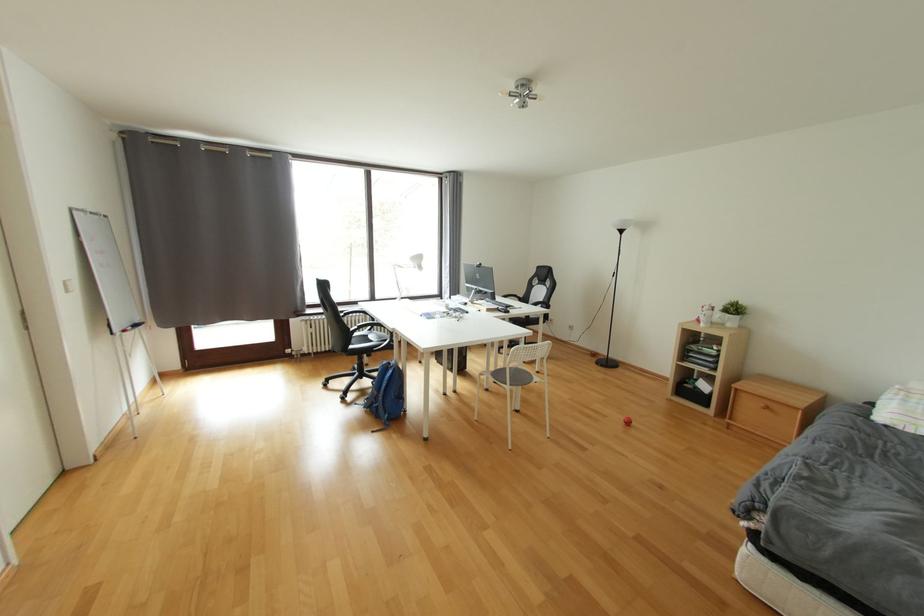
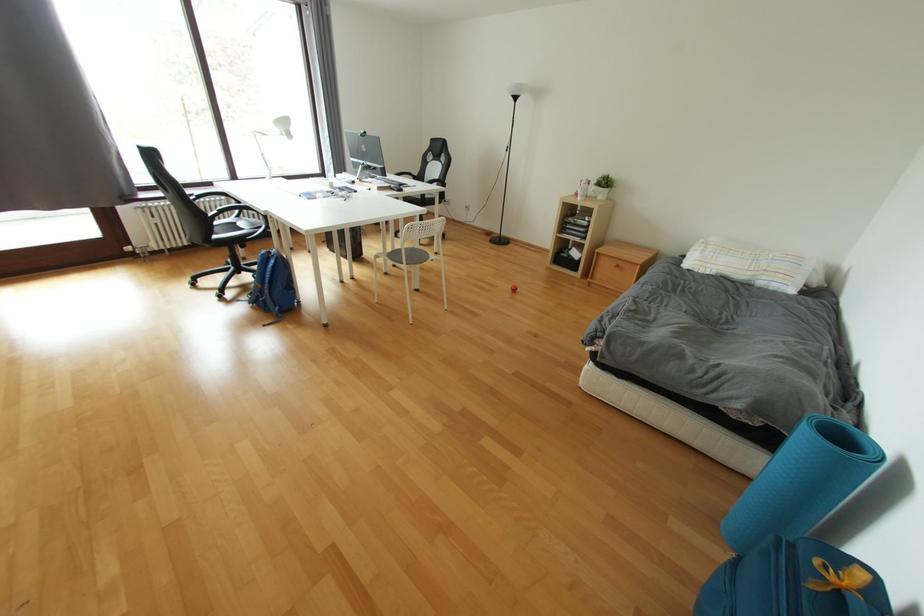
Question: The images are taken continuously from a first-person perspective. In which direction are you moving?

Choices:
 (A) Left
 (B) Right
 (C) Forward
 (D) Backward

Answer: (B)